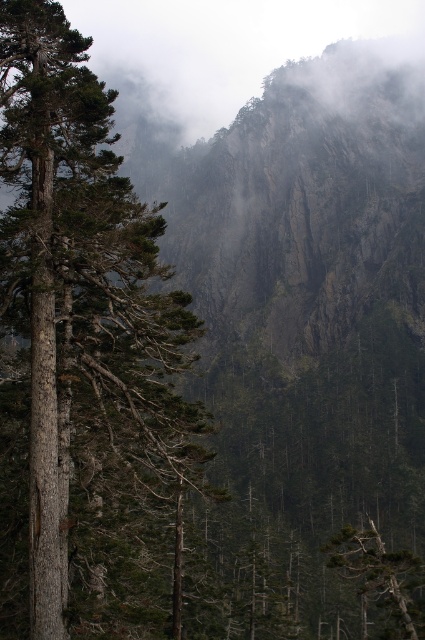
Which is more to the right, brown textured tree trunk at left or green matte tree at lower right?

From the viewer's perspective, green matte tree at lower right appears more on the right side.

Is point (8, 528) in front of point (413, 580)?

Yes, it is in front of point (413, 580).

Find the location of a particular element. The width and height of the screenshot is (425, 640). brown textured tree trunk at left is located at coordinates (84, 355).